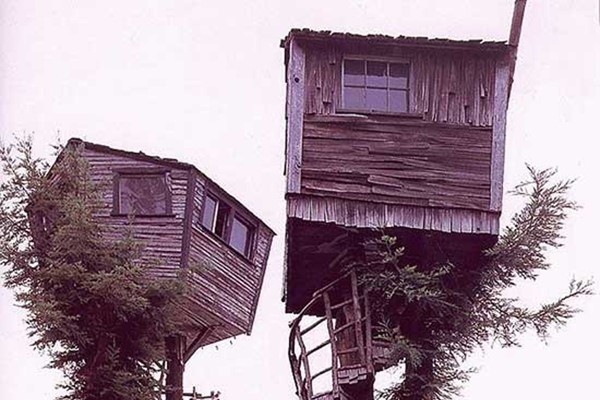
This screenshot has height=400, width=600. Identify the location of wood post. (178, 359).